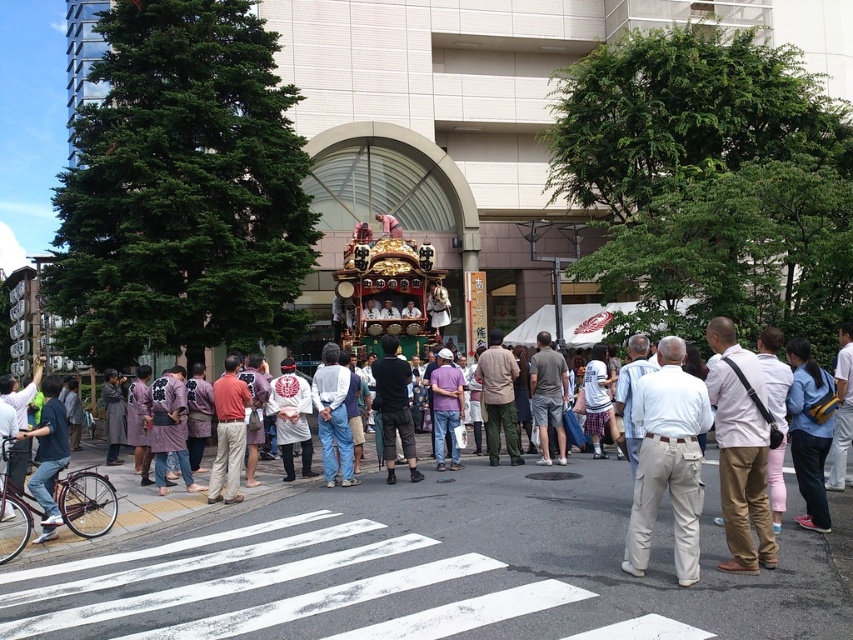
You are standing at the point with coordinates point (314,397) and want to walk towards the point with coordinates point (111,579). Is the point you want to walk to located in front of you?

Yes, the point (111,579) is in front of point (314,397), so the point you want to walk to is located in front of you.

You are a photographer trying to capture the vibrant festival scene. You notice two people in the crowd wearing beige cotton pants at center and denim jeans at left. Which of these two clothing items appears narrower in the image?

The beige cotton pants at center appears narrower than the denim jeans at left.

You are a pedestrian standing at the edge of the street. You see a white painted crosswalk at center and denim pants at center. Which one is wider?

The white painted crosswalk at center is wider than denim pants at center.